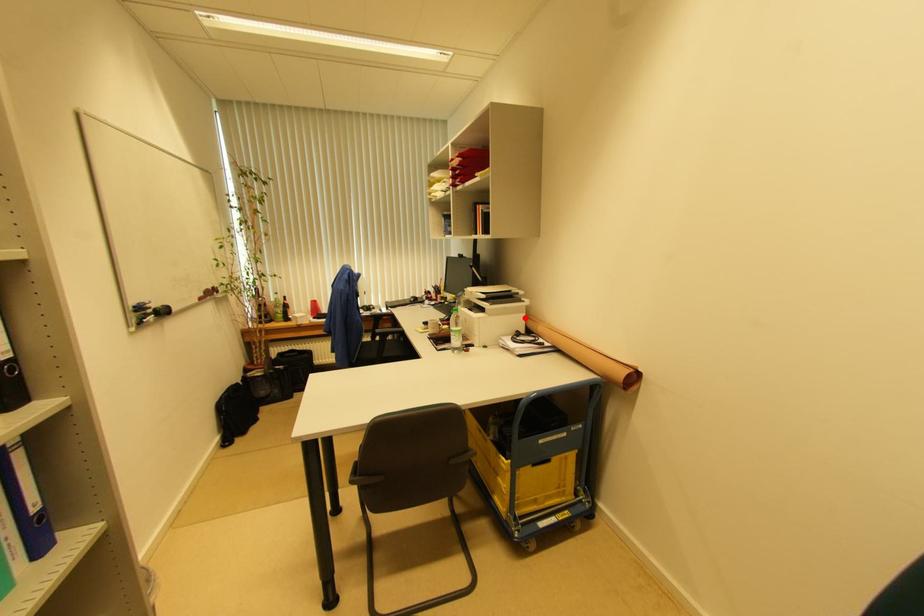
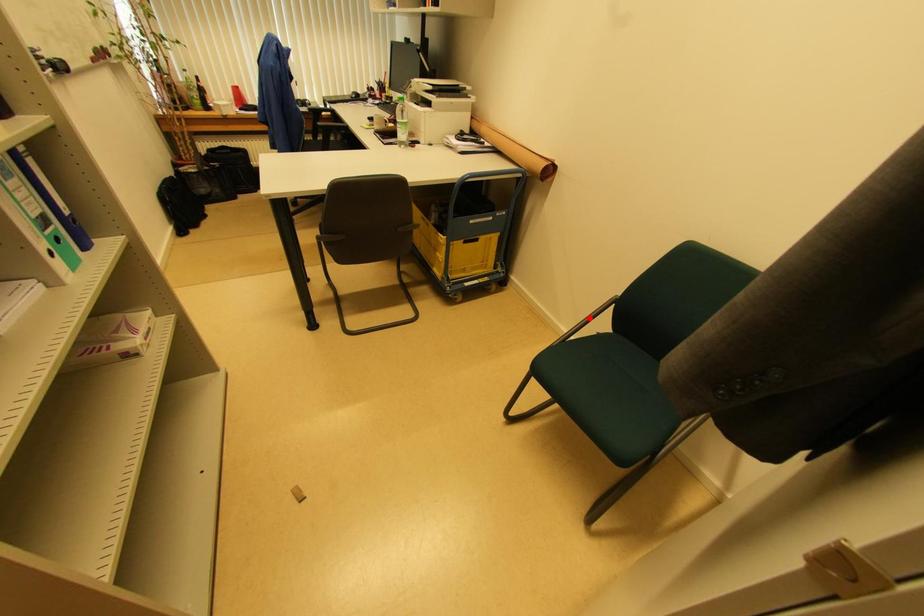
I am providing you with two images of the same scene from different viewpoints. A red point is marked on the first image and another point is marked on the second image. Does the point marked in image1 correspond to the same location as the one in image2?

No